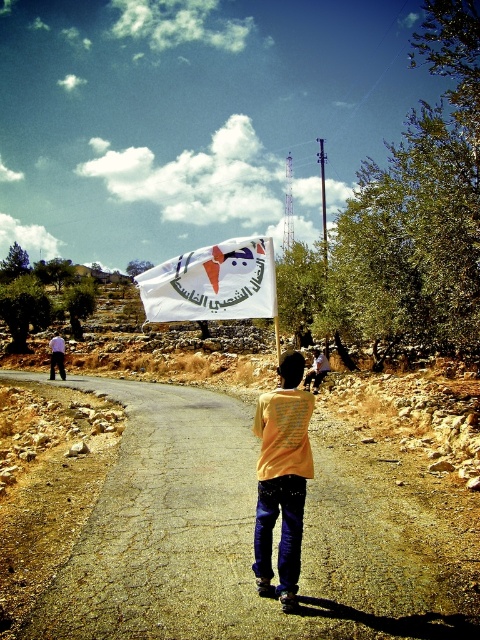
From the picture: Can you confirm if yellow matte shirt at center is wider than white fabric flag at center?

Incorrect, yellow matte shirt at center's width does not surpass white fabric flag at center's.

Does point (298, 572) come behind point (212, 317)?

No.

Where is `yellow matte shirt at center`? The width and height of the screenshot is (480, 640). yellow matte shirt at center is located at coordinates (282, 477).